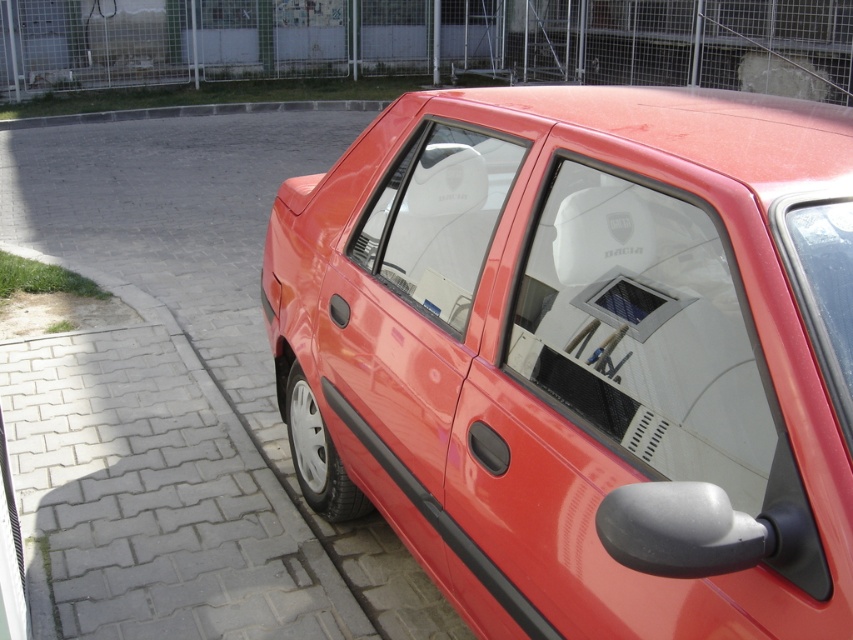
You are a delivery person trying to place a package on the roof of the red Dacia car. The package is 1 meter wide. Can you fit the package on the roof without it hanging over the edges? Consider the positions of the glossy plastic car door at center and transparent glass windshield at upper right.

→ The glossy plastic car door at center is positioned under the transparent glass windshield at upper right, but this does not provide information about the roof dimensions. The question cannot be answered with the given details.

You are a delivery person trying to place a package on the glossy plastic car door at center and the transparent glass windshield at upper right. Since the package is heavy, you need to choose the surface that can support it. Which object should you choose?

The glossy plastic car door at center is larger in size than the transparent glass windshield at upper right, so it can support the heavy package better.